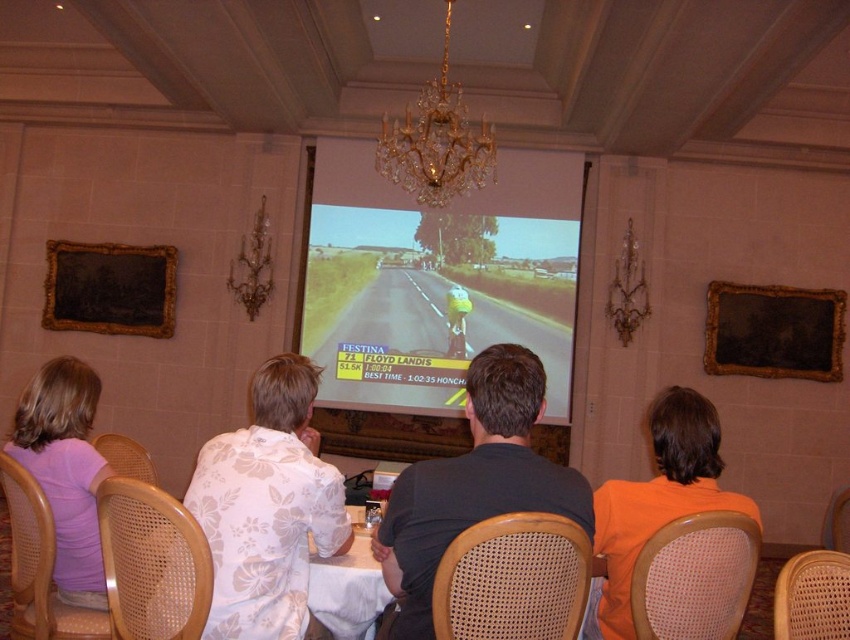
Is point (85, 268) closer to viewer compared to point (378, 596)?

No, (85, 268) is behind (378, 596).

Between point (60, 282) and point (348, 509), which one is positioned in front?

Positioned in front is point (348, 509).

Who is more forward, (156, 324) or (363, 609)?

Point (363, 609) is more forward.

Identify the location of gold-framed picture at upper left. Image resolution: width=850 pixels, height=640 pixels. (109, 289).

Is dark blue shirt at center below gold crystal chandelier at upper center?

Yes, dark blue shirt at center is below gold crystal chandelier at upper center.

Identify the location of dark blue shirt at center. (473, 483).

Can you confirm if white floral shirt at center is positioned to the left of dark blue shirt at center?

Correct, you'll find white floral shirt at center to the left of dark blue shirt at center.

Which is more to the right, white floral shirt at center or dark blue shirt at center?

From the viewer's perspective, dark blue shirt at center appears more on the right side.

I want to click on white floral shirt at center, so click(267, 508).